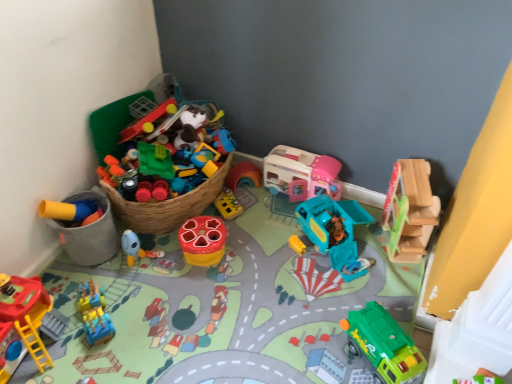
At what (x,y) coordinates should I click in order to perform the action: click on empty space that is in between teal plastic truck at center, which ranks as the third toy in right-to-left order, and rubberized plastic toy at center, which is counted as the 5th toy, starting from the right. Please return your answer as a coordinate pair (x, y). The width and height of the screenshot is (512, 384). Looking at the image, I should click on (260, 246).